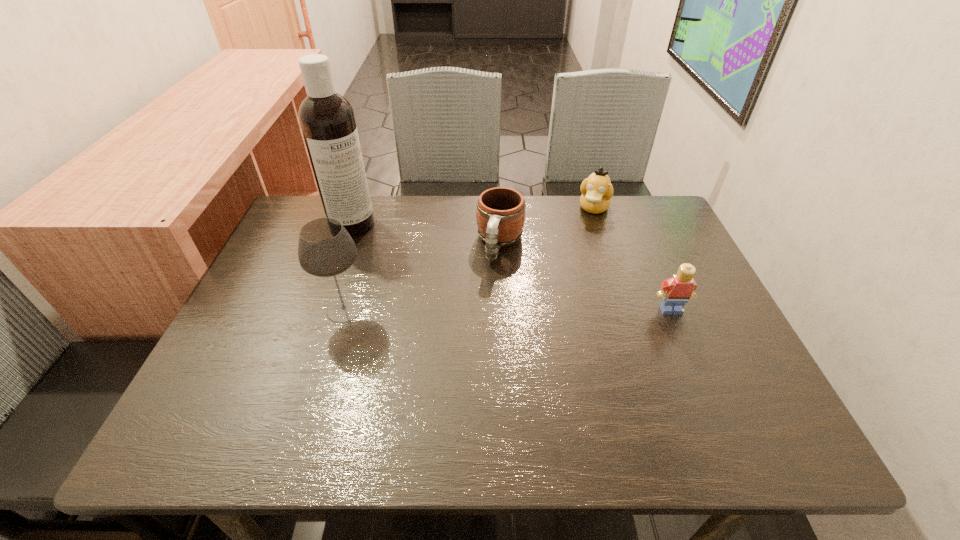
Where is `free space between the tallest object and the Lego`? free space between the tallest object and the Lego is located at coordinates (512, 267).

Image resolution: width=960 pixels, height=540 pixels. In order to click on free space between the Lego and the dishwasher detergent in this screenshot , I will do `click(512, 267)`.

Find the location of a particular element. The width and height of the screenshot is (960, 540). free spot between the rightmost object and the dishwasher detergent is located at coordinates (512, 267).

Where is `unoccupied area between the dishwasher detergent and the duckling`? unoccupied area between the dishwasher detergent and the duckling is located at coordinates (473, 216).

Where is `blank region between the third object from left to right and the tallest object`? The height and width of the screenshot is (540, 960). blank region between the third object from left to right and the tallest object is located at coordinates (426, 234).

You are a GUI agent. You are given a task and a screenshot of the screen. Output one action in this format:
    pyautogui.click(x=<x>, y=<y>)
    Task: Click on the second closest object to the mug
    This screenshot has width=960, height=540.
    Given the screenshot: What is the action you would take?
    pyautogui.click(x=325, y=249)

Where is `the fourth closest object to the dishwasher detergent`? This screenshot has height=540, width=960. the fourth closest object to the dishwasher detergent is located at coordinates (675, 292).

Identify the location of vacant area that satisfies the following two spatial constraints: 1. on the back side of the duckling; 2. on the left side of the tallest object. (358, 208).

Identify the location of free space in the image that satisfies the following two spatial constraints: 1. on the back side of the dishwasher detergent; 2. on the right side of the duckling. (358, 208).